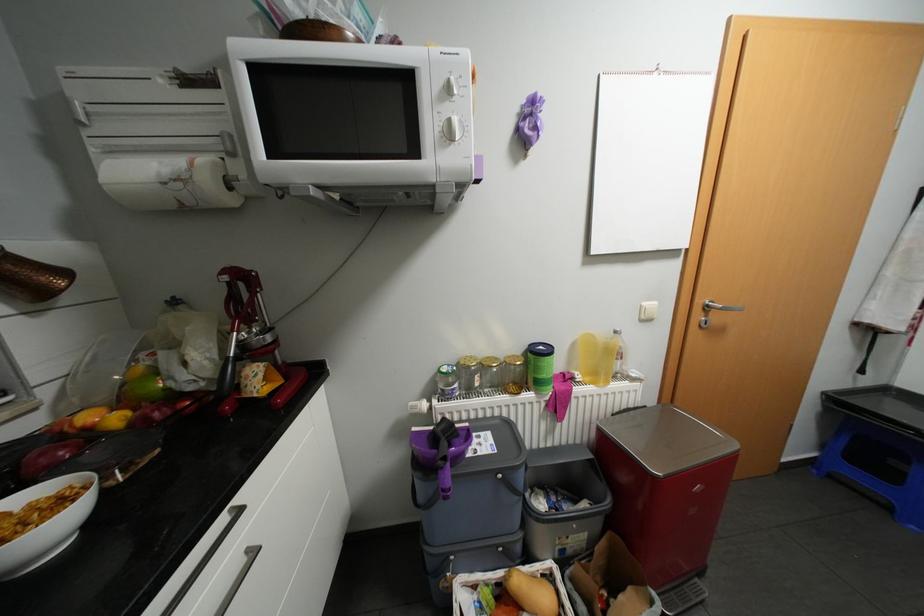
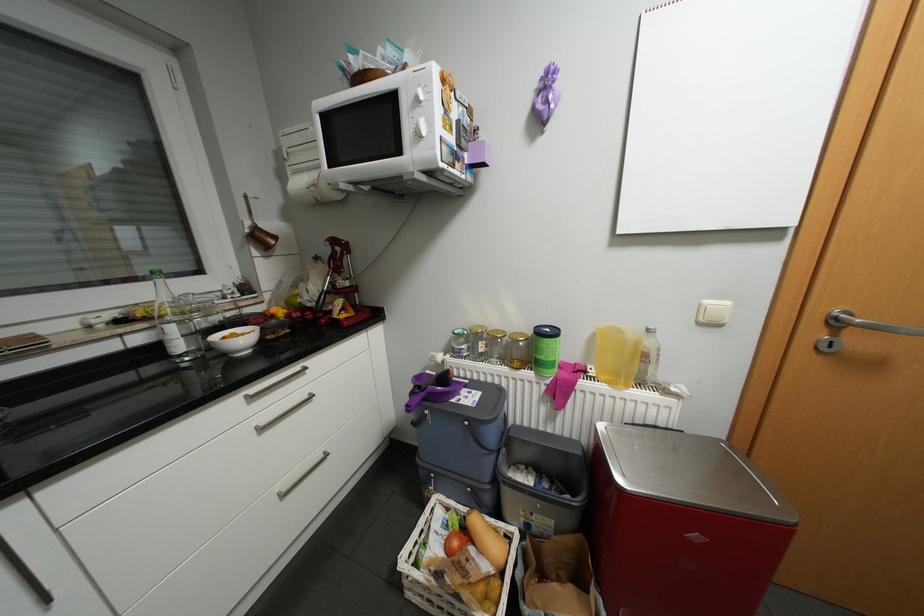
Locate, in the second image, the point that corresponds to the point at 649,320 in the first image.

(708, 323)